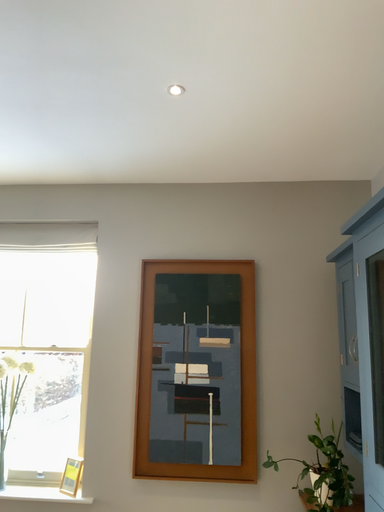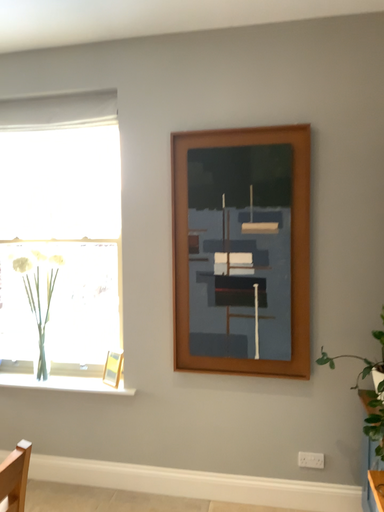
Question: Which way did the camera rotate in the video?

Choices:
 (A) rotated downward
 (B) rotated upward

Answer: (A)